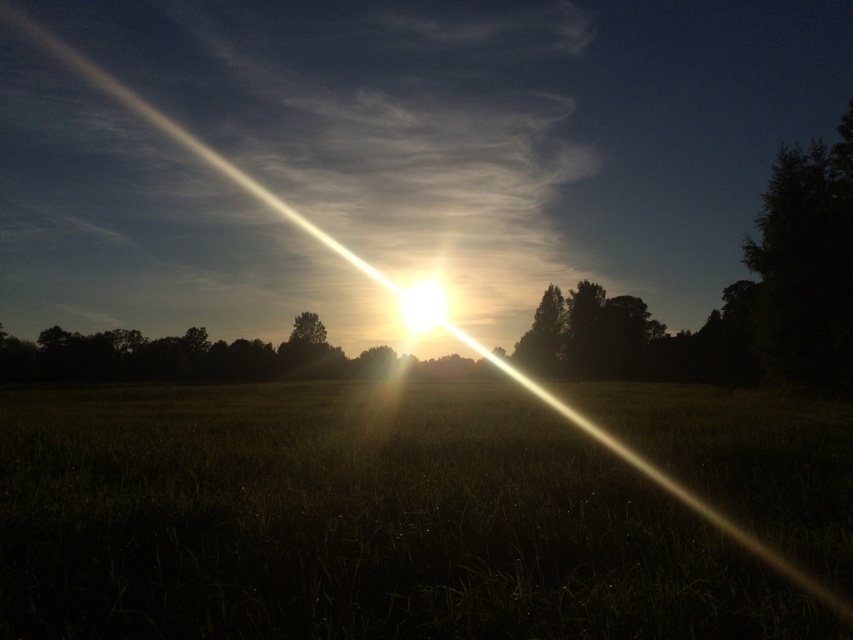
Does green matte grass at center appear over green leafy tree at center?

No, green matte grass at center is not above green leafy tree at center.

Where is `green matte grass at center`? The height and width of the screenshot is (640, 853). green matte grass at center is located at coordinates (x=352, y=522).

Find the location of `green matte grass at center`. green matte grass at center is located at coordinates (352, 522).